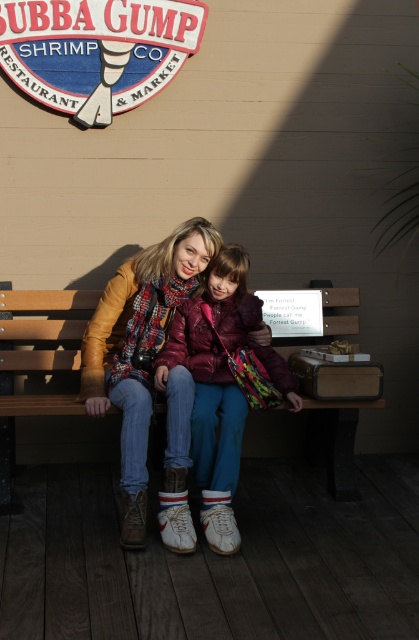
You are standing at the Bubba Gump Shrimp Co. sign and want to take a photo of the plaque on the bench. The plaque is located at point (132, 83). There is another point at (188, 259). Which point is closer to you?

Point (188, 259) is in front of point (132, 83), so it is closer to you.

What is the exact 2D coordinate of the matte plaid scarf at center?

The exact 2D coordinate of the matte plaid scarf at center is at point (139, 348).

You are a tailor who wants to create a custom cover for the wooden bench at center using the same material as the matte plaid scarf at center. Given that the scarf is larger, will you need additional fabric to cover the entire bench?

The matte plaid scarf at center has a larger size compared to the wooden bench at center. Since the scarf is bigger, it might not be sufficient to cover the entire bench. Additional fabric would likely be needed to ensure full coverage.